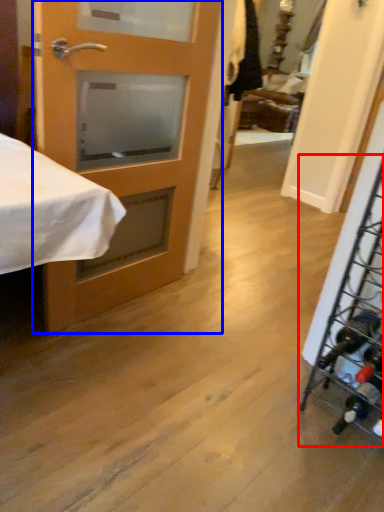
Question: Which object is further to the camera taking this photo, wine rack (highlighted by a red box) or door (highlighted by a blue box)?

Choices:
 (A) wine rack
 (B) door

Answer: (B)